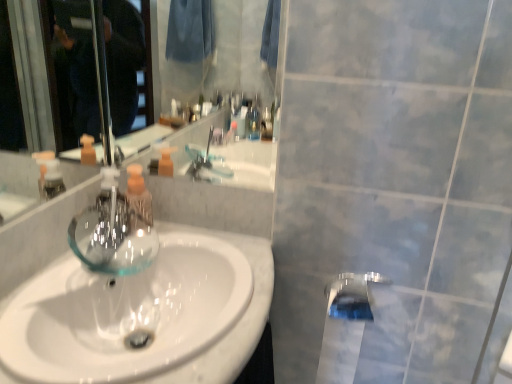
Locate an element on the screen. The image size is (512, 384). clear glass bottle at center is located at coordinates (138, 199).

Measure the distance between point (347, 288) and camera.

The distance of point (347, 288) from camera is 1.12 meters.

Image resolution: width=512 pixels, height=384 pixels. What do you see at coordinates (352, 295) in the screenshot?
I see `chrome metallic tap at lower center` at bounding box center [352, 295].

Locate an element on the screen. Image resolution: width=512 pixels, height=384 pixels. white glossy sink at center is located at coordinates (237, 322).

Which is behind, white glossy sink at center or clear glass faucet at center?

Positioned behind is clear glass faucet at center.

Would you say white glossy sink at center is outside clear glass faucet at center?

Yes, white glossy sink at center is outside of clear glass faucet at center.

Considering the relative sizes of white glossy sink at center and clear glass faucet at center in the image provided, is white glossy sink at center smaller than clear glass faucet at center?

Incorrect, white glossy sink at center is not smaller in size than clear glass faucet at center.

Is white glossy sink at center positioned far away from chrome metallic tap at lower center?

No, white glossy sink at center is not far away from chrome metallic tap at lower center.

Between white glossy sink at center and chrome metallic tap at lower center, which one appears on the right side from the viewer's perspective?

From the viewer's perspective, chrome metallic tap at lower center appears more on the right side.

Could you tell me if white glossy sink at center is facing chrome metallic tap at lower center?

Yes, white glossy sink at center faces towards chrome metallic tap at lower center.

Is point (246, 239) farther from viewer compared to point (362, 295)?

Yes.

Could you tell me if clear glass faucet at center is facing white glossy sink at center?

No, clear glass faucet at center is not aimed at white glossy sink at center.

Is white glossy sink at center a part of clear glass faucet at center?

No, white glossy sink at center is not surrounded by clear glass faucet at center.

Is clear glass faucet at center placed right next to white glossy sink at center?

No, clear glass faucet at center is not making contact with white glossy sink at center.

Does clear glass bottle at center turn towards chrome metallic tap at lower center?

Yes, clear glass bottle at center is facing chrome metallic tap at lower center.

Is clear glass bottle at center taller than chrome metallic tap at lower center?

Yes, clear glass bottle at center is taller than chrome metallic tap at lower center.

Which is correct: clear glass bottle at center is inside chrome metallic tap at lower center, or outside of it?

clear glass bottle at center is not enclosed by chrome metallic tap at lower center.

Looking at this image, is there a large distance between clear glass bottle at center and chrome metallic tap at lower center?

clear glass bottle at center is near chrome metallic tap at lower center, not far away.

Is chrome metallic tap at lower center in front of clear glass faucet at center?

Yes, chrome metallic tap at lower center is closer to the viewer.

Which object is positioned more to the right, chrome metallic tap at lower center or clear glass faucet at center?

chrome metallic tap at lower center.

Is chrome metallic tap at lower center oriented away from clear glass faucet at center?

No, chrome metallic tap at lower center's orientation is not away from clear glass faucet at center.

How many degrees apart are the facing directions of chrome metallic tap at lower center and clear glass faucet at center?

The angle between the facing direction of chrome metallic tap at lower center and the facing direction of clear glass faucet at center is 89.9 degrees.

The height and width of the screenshot is (384, 512). What are the coordinates of `mouthwash above the white glossy sink at center (from the image's perspective)` in the screenshot? It's located at pos(138,199).

Considering the relative sizes of clear glass bottle at center and white glossy sink at center in the image provided, is clear glass bottle at center thinner than white glossy sink at center?

Correct, the width of clear glass bottle at center is less than that of white glossy sink at center.

From the image's perspective, which one is positioned higher, clear glass bottle at center or white glossy sink at center?

clear glass bottle at center appears higher in the image.

Is clear glass bottle at center looking in the opposite direction of white glossy sink at center?

clear glass bottle at center does not have its back to white glossy sink at center.

Where is `mouthwash above the white glossy sink at center (from a real-world perspective)`? The width and height of the screenshot is (512, 384). mouthwash above the white glossy sink at center (from a real-world perspective) is located at coordinates [138, 199].

Can you confirm if white glossy sink at center is thinner than clear glass bottle at center?

No, white glossy sink at center is not thinner than clear glass bottle at center.

Would you consider white glossy sink at center to be distant from clear glass bottle at center?

No, white glossy sink at center is not far from clear glass bottle at center.

From the image's perspective, is white glossy sink at center located above or below clear glass bottle at center?

Based on their image positions, white glossy sink at center is located beneath clear glass bottle at center.

Where is `faucet above the white glossy sink at center (from a real-world perspective)`? faucet above the white glossy sink at center (from a real-world perspective) is located at coordinates (111, 212).

This screenshot has width=512, height=384. Find the location of `tap above the white glossy sink at center (from the image's perspective)`. tap above the white glossy sink at center (from the image's perspective) is located at coordinates (352, 295).

Estimate the real-world distances between objects in this image. Which object is further from chrome metallic tap at lower center, clear glass faucet at center or white glossy sink at center?

clear glass faucet at center is positioned further to the anchor chrome metallic tap at lower center.

When comparing their distances from chrome metallic tap at lower center, does white glossy sink at center or clear glass faucet at center seem closer?

The object closer to chrome metallic tap at lower center is white glossy sink at center.

From the image, which object appears to be farther from white glossy sink at center, chrome metallic tap at lower center or clear glass faucet at center?

chrome metallic tap at lower center is positioned further to the anchor white glossy sink at center.

Which object lies nearer to the anchor point clear glass bottle at center, chrome metallic tap at lower center or clear glass faucet at center?

clear glass faucet at center lies closer to clear glass bottle at center than the other object.

Based on their spatial positions, is clear glass bottle at center or clear glass faucet at center closer to chrome metallic tap at lower center?

The object closer to chrome metallic tap at lower center is clear glass bottle at center.

Looking at this image, when comparing their distances from clear glass bottle at center, does clear glass faucet at center or white glossy sink at center seem closer?

clear glass faucet at center.

Which object lies further to the anchor point clear glass faucet at center, white glossy sink at center or clear glass bottle at center?

The object further to clear glass faucet at center is white glossy sink at center.

Based on their spatial positions, is white glossy sink at center or clear glass faucet at center closer to clear glass bottle at center?

The object closer to clear glass bottle at center is clear glass faucet at center.

Locate an element on the screen. This screenshot has height=384, width=512. sink located between clear glass bottle at center and chrome metallic tap at lower center in the left-right direction is located at coordinates pos(237,322).

The height and width of the screenshot is (384, 512). What are the coordinates of `sink located between clear glass faucet at center and chrome metallic tap at lower center in the left-right direction` in the screenshot? It's located at (237, 322).

Find the location of a particular element. The width and height of the screenshot is (512, 384). faucet positioned between white glossy sink at center and clear glass bottle at center from near to far is located at coordinates (111, 212).

This screenshot has width=512, height=384. I want to click on mouthwash between clear glass faucet at center and chrome metallic tap at lower center from left to right, so click(138, 199).